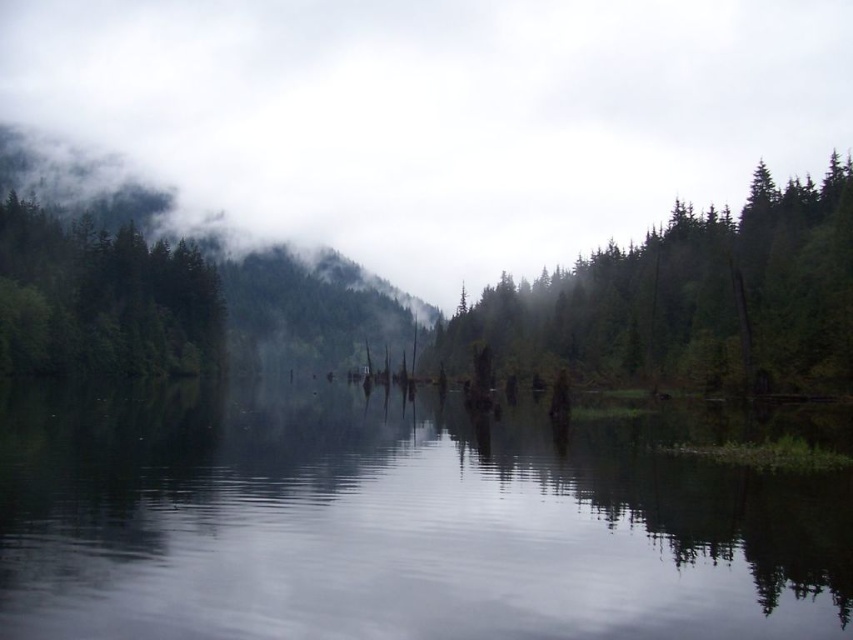
Question: Does white fluffy clouds at upper center have a lesser width compared to green matte tree at upper left?

Choices:
 (A) yes
 (B) no

Answer: (B)

Question: Is green matte tree at center bigger than green matte tree at upper left?

Choices:
 (A) no
 (B) yes

Answer: (B)

Question: Among these points, which one is nearest to the camera?

Choices:
 (A) (758, 381)
 (B) (194, 358)
 (C) (93, 300)

Answer: (A)

Question: Does smooth water at center appear over green matte tree at upper left?

Choices:
 (A) no
 (B) yes

Answer: (A)

Question: Which object is farther from the camera taking this photo?

Choices:
 (A) green textured forest at upper left
 (B) white fluffy clouds at upper center

Answer: (B)

Question: Which point appears farthest from the camera in this image?

Choices:
 (A) (57, 529)
 (B) (602, 224)
 (C) (123, 244)

Answer: (B)